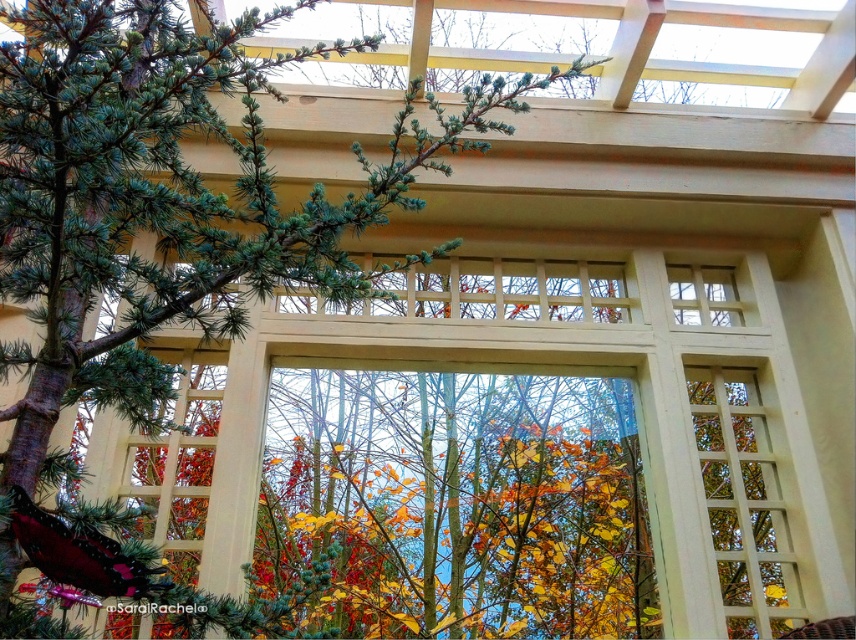
You are standing at the entrance of the pergola and want to walk towards the two points marked in the image. Which point, point (367, 605) or point (117, 358), will you reach first?

Point (367, 605) is further to the viewer than point (117, 358), so you will reach point (367, 605) first.

You are standing in the outdoor scene under the wooden pergola. You notice a point marked at coordinates (x=501, y=452). What object is located at this point?

The point at coordinates (x=501, y=452) marks the location of the white lattice window at center.